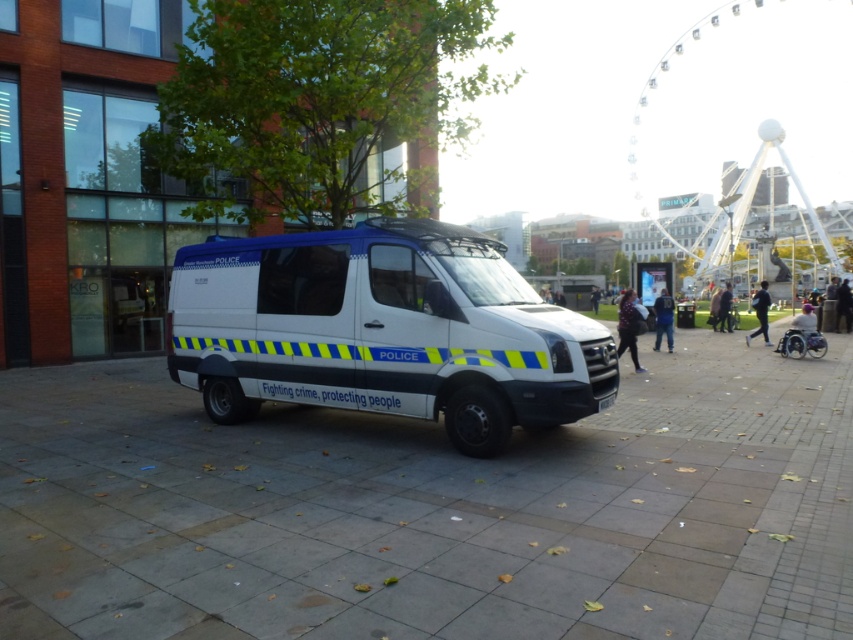
Question: Which point is farther to the camera?

Choices:
 (A) white paved at center
 (B) blue jeans at center
 (C) floral-patterned dress at center
 (D) dark blue fabric jacket at center

Answer: (D)

Question: Does white paved at center lie behind white plastic van at center?

Choices:
 (A) yes
 (B) no

Answer: (B)

Question: Which point appears closest to the camera in this image?

Choices:
 (A) (628, 314)
 (B) (727, 317)
 (C) (763, 333)
 (D) (843, 310)

Answer: (A)

Question: In this image, where is white paved at center located relative to blue jeans at center?

Choices:
 (A) left
 (B) right

Answer: (A)

Question: Among these points, which one is farthest from the camera?

Choices:
 (A) (355, 344)
 (B) (666, 342)

Answer: (B)

Question: Does floral-patterned dress at center have a smaller size compared to dark brown leather jacket at center?

Choices:
 (A) no
 (B) yes

Answer: (A)